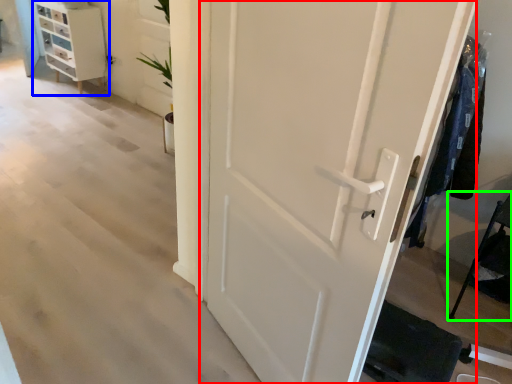
Question: Based on their relative distances, which object is nearer to door (highlighted by a red box)? Choose from chest of drawers (highlighted by a blue box) and furniture (highlighted by a green box).

Choices:
 (A) chest of drawers
 (B) furniture

Answer: (B)